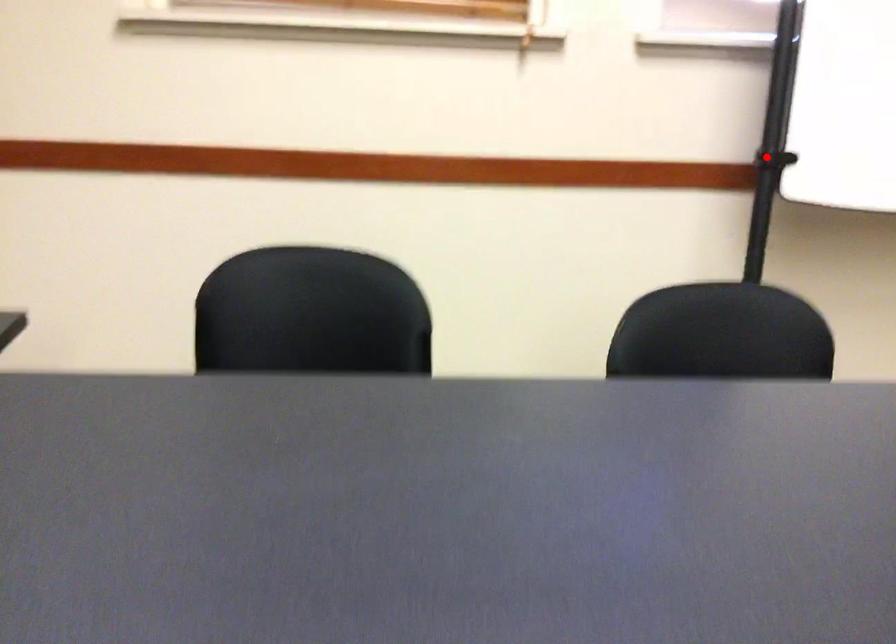
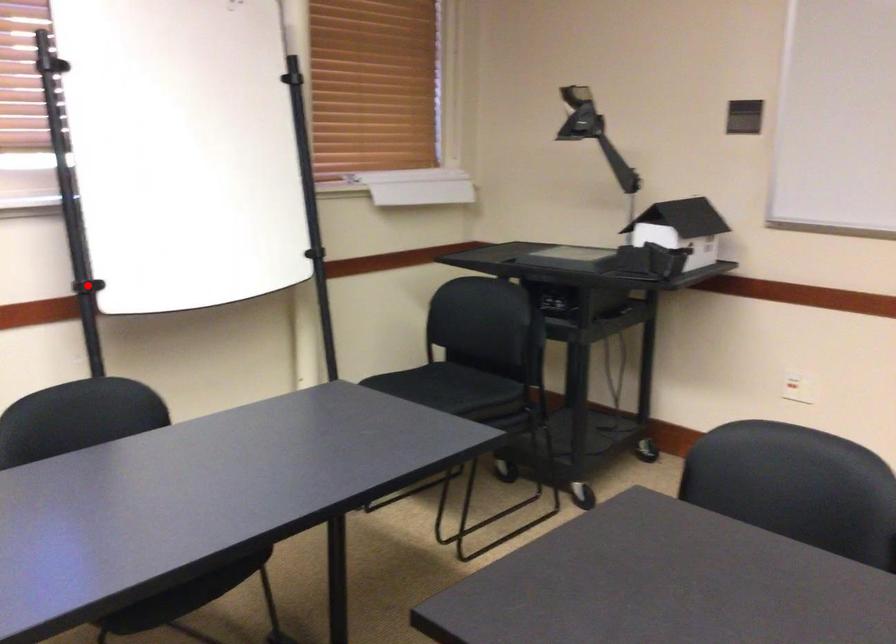
I am providing you with two images of the same scene from different viewpoints. A red point is marked on the first image and another point is marked on the second image. Is the red point in image1 aligned with the point shown in image2?

Yes